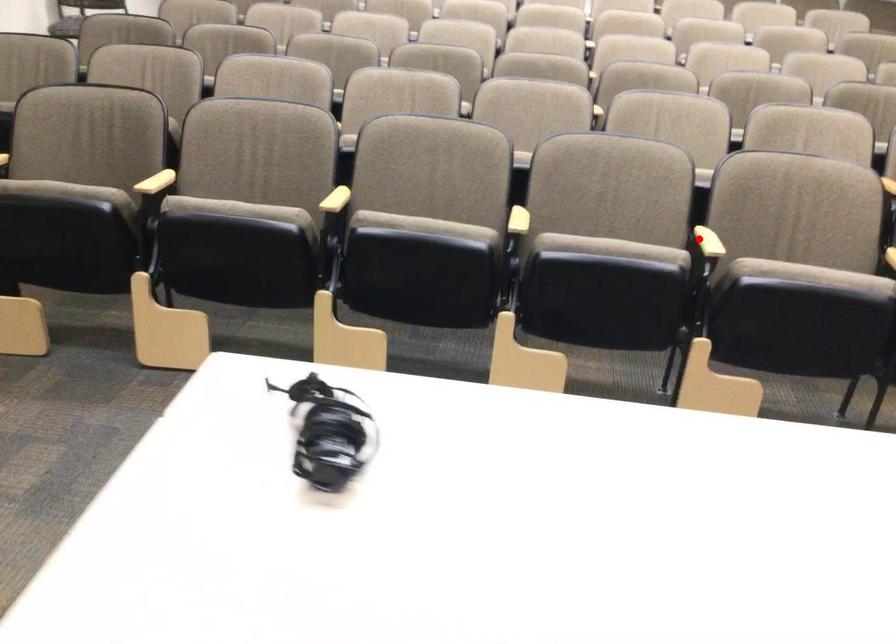
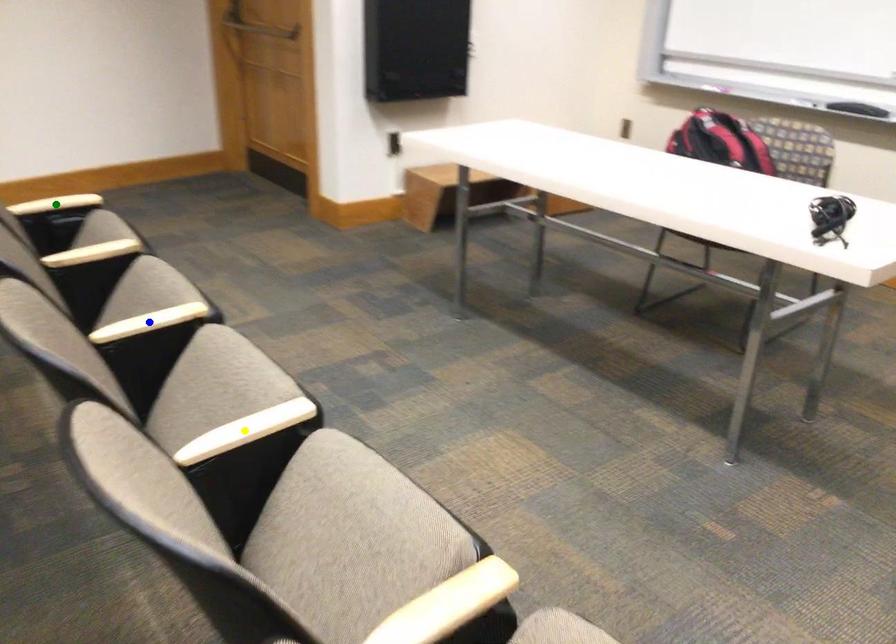
Question: I am providing you with two images of the same scene from different viewpoints. A red point is marked on the first image. You are given multiple points on the second image. Which mark in image 2 goes with the point in image 1?

Choices:
 (A) green point
 (B) yellow point
 (C) blue point

Answer: (C)